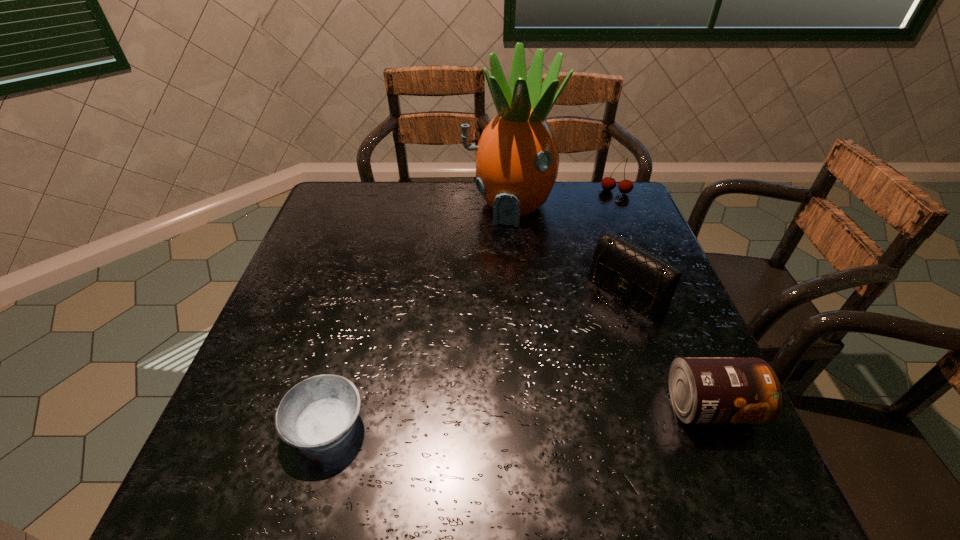
This screenshot has height=540, width=960. In the image, there is a desktop. In order to click on free region at the left edge in this screenshot , I will do `click(282, 335)`.

At what (x,y) coordinates should I click in order to perform the action: click on vacant space at the right edge of the desktop. Please return your answer as a coordinate pair (x, y). This screenshot has height=540, width=960. Looking at the image, I should click on (652, 356).

Where is `free region at the near left corner of the desktop`? The height and width of the screenshot is (540, 960). free region at the near left corner of the desktop is located at coordinates (267, 431).

You are a GUI agent. You are given a task and a screenshot of the screen. Output one action in this format:
    pyautogui.click(x=<x>, y=<y>)
    Task: Click on the vacant space at the far right corner of the desktop
    Image resolution: width=960 pixels, height=540 pixels.
    Given the screenshot: What is the action you would take?
    pyautogui.click(x=589, y=204)

Where is `free spot between the clutch bag and the leftmost object`? The height and width of the screenshot is (540, 960). free spot between the clutch bag and the leftmost object is located at coordinates (476, 360).

This screenshot has height=540, width=960. What are the coordinates of `blank region between the shortest object and the third farthest object` in the screenshot? It's located at (476, 360).

Locate an element on the screen. This screenshot has height=540, width=960. free space between the cherry and the tallest object is located at coordinates (563, 199).

This screenshot has height=540, width=960. Find the location of `free space between the can and the shortest object`. free space between the can and the shortest object is located at coordinates (518, 417).

Identify the location of free space between the clutch bag and the pineapple. (567, 249).

This screenshot has height=540, width=960. I want to click on free space between the cherry and the second object from left to right, so click(x=563, y=199).